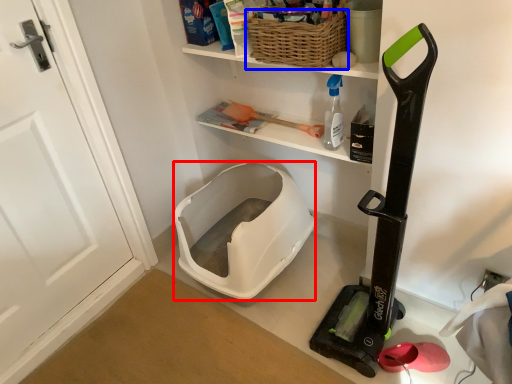
Question: Which object is closer to the camera taking this photo, wide (highlighted by a red box) or basket (highlighted by a blue box)?

Choices:
 (A) wide
 (B) basket

Answer: (B)